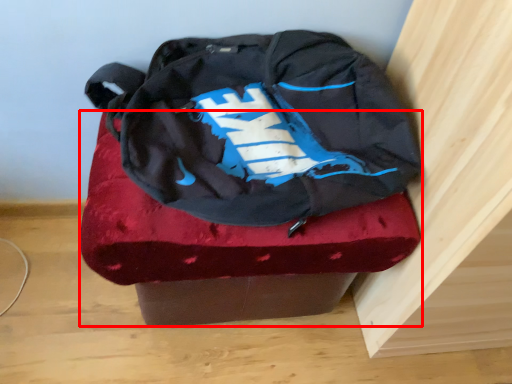
Question: In this image, where is furniture (annotated by the red box) located relative to backpack?

Choices:
 (A) left
 (B) right

Answer: (A)